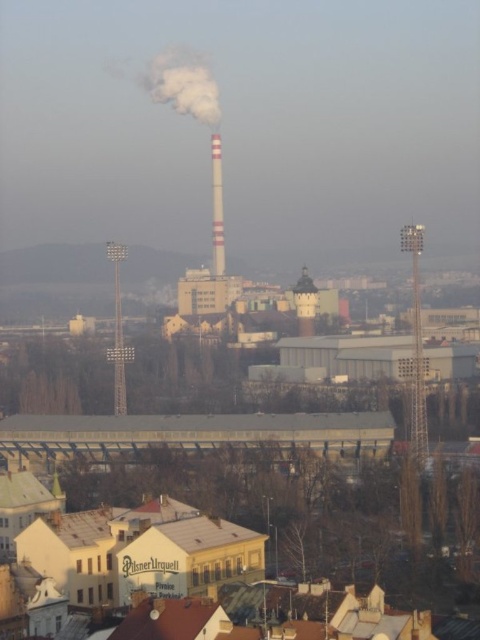
You are a drone operator who needs to deliver a package to the white glossy chimney at center. There is another smooth white chimney at center nearby. How far apart are the two chimneys?

The white glossy chimney at center is 27.89 meters away from the smooth white chimney at center.

Based on the photo, you are standing at the base of the industrial complex and want to reach a specific point marked at coordinates point (155, 84). Given that you can walk 1000 feet before needing to rest, do you need to rest before reaching that point?

The point (155, 84) is 1315.90 feet away from the viewer. Since you can walk 1000 feet before needing to rest, you will need to rest before reaching the point as the distance exceeds your walking limit.